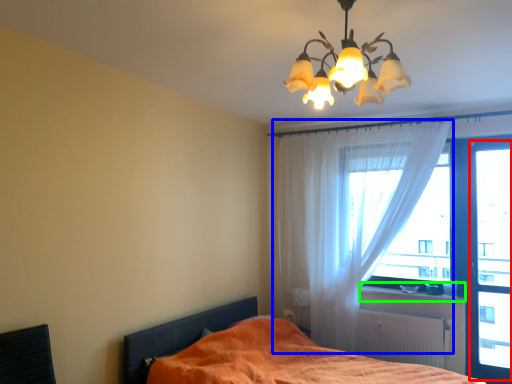
Question: Which object is positioned closest to window screen (highlighted by a red box)? Select from curtain (highlighted by a blue box) and window sill (highlighted by a green box).

Choices:
 (A) curtain
 (B) window sill

Answer: (B)